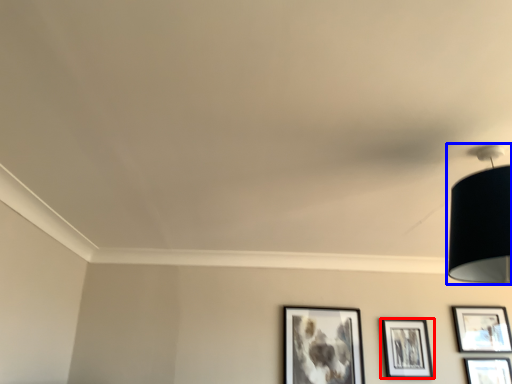
Question: Among these objects, which one is farthest to the camera, picture frame (highlighted by a red box) or lamp (highlighted by a blue box)?

Choices:
 (A) picture frame
 (B) lamp

Answer: (A)